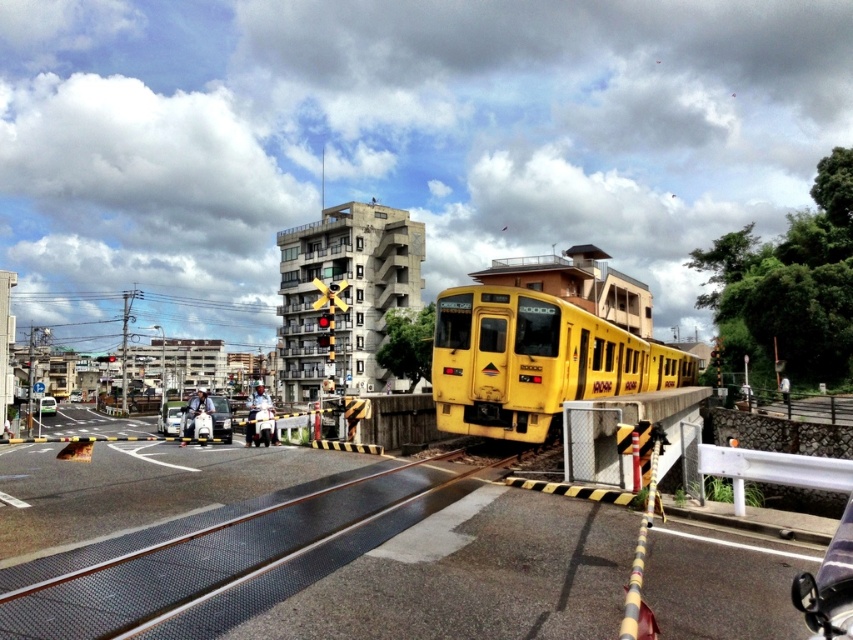
In the scene shown: You are a pedestrian standing at the green matte car at lower left and want to cross the road to reach the yellow matte train at center. Considering their sizes, which one would block your path more if you tried to walk between them?

The yellow matte train at center has a larger width than the green matte car at lower left, so it would block your path more if you tried to walk between them.

Consider the image. You are a pedestrian waiting at the railway level crossing. You see the yellow matte train at center and the white matte car at center. Which one is closer to the barriers?

The yellow matte train at center is above the white matte car at center, so the white matte car at center is closer to the barriers.